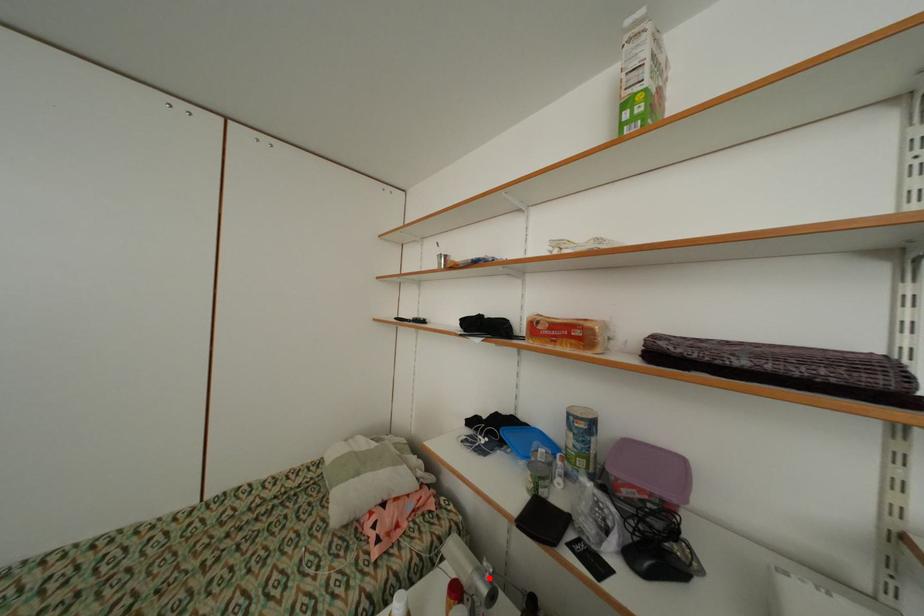
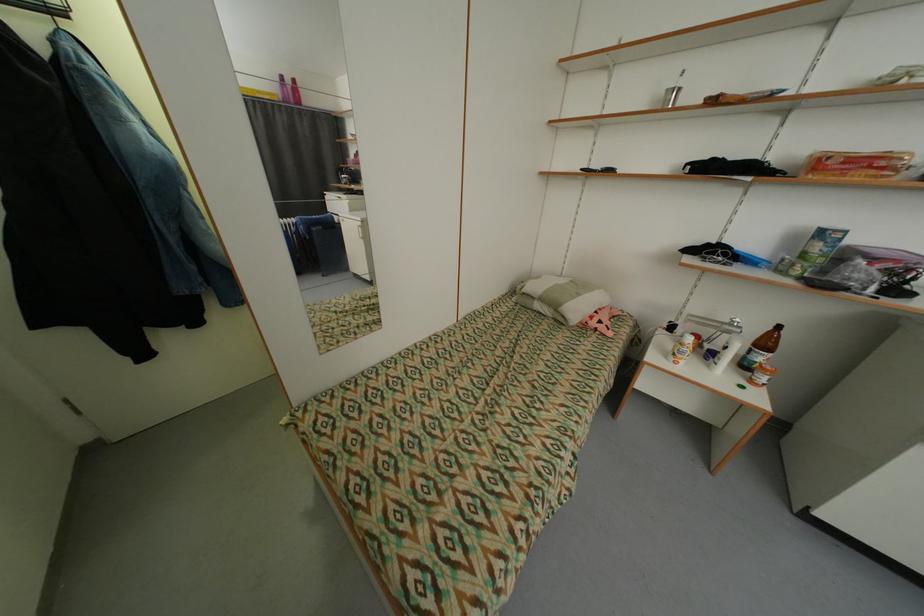
In the second image, find the point that corresponds to the highlighted location in the first image.

(736, 326)